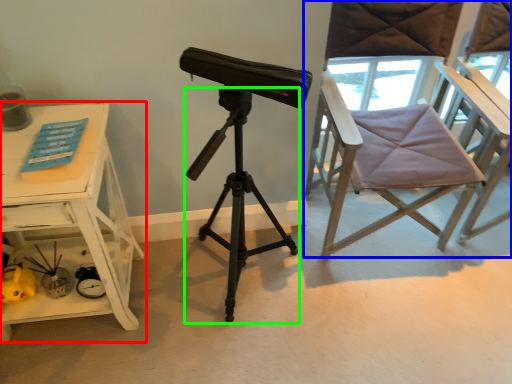
Question: Which object is positioned closest to table (highlighted by a red box)? Select from chair (highlighted by a blue box) and tripod (highlighted by a green box).

Choices:
 (A) chair
 (B) tripod

Answer: (B)